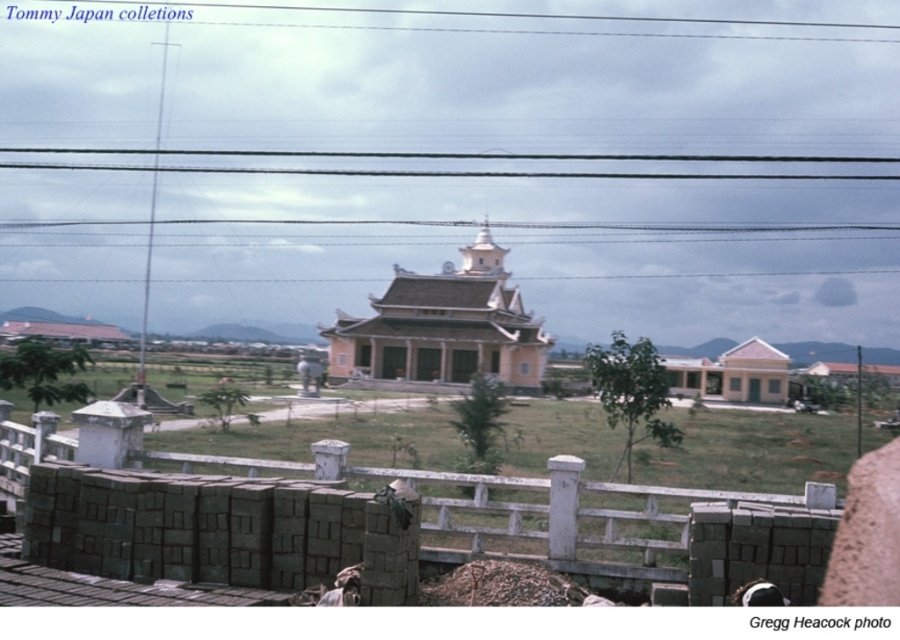
From the picture: You are a visitor standing at the entrance of the beige smooth temple at center. You want to take a photo of the temple without any obstructions. Is the white concrete fence at lower center blocking your view of the temple?

The white concrete fence at lower center is in front of the beige smooth temple at center, so it would block your view of the temple.

You are a surveyor inspecting the construction site. You notice the white concrete fence at lower center and the black wire at upper center. Which object is positioned higher in the image?

The black wire at upper center is positioned higher than the white concrete fence at lower center.